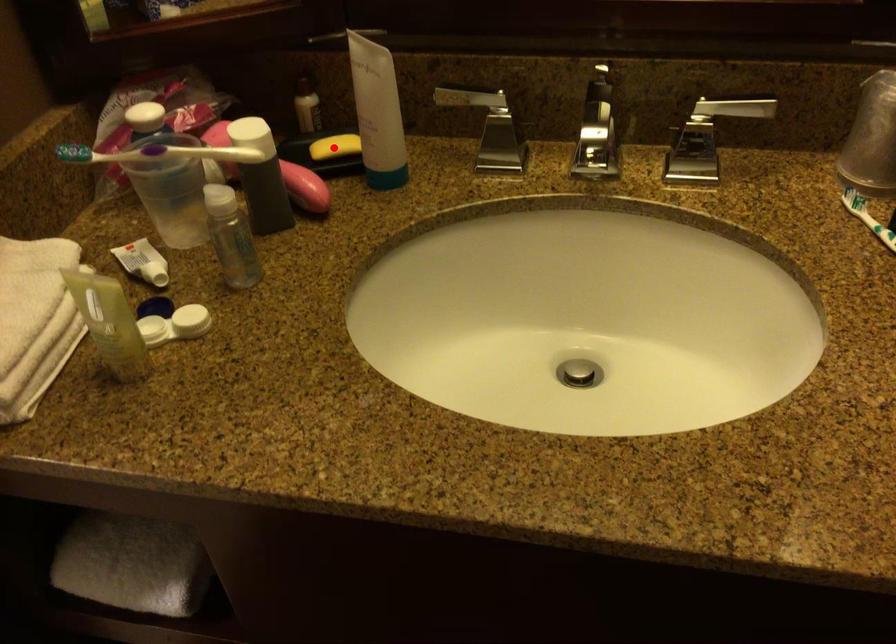
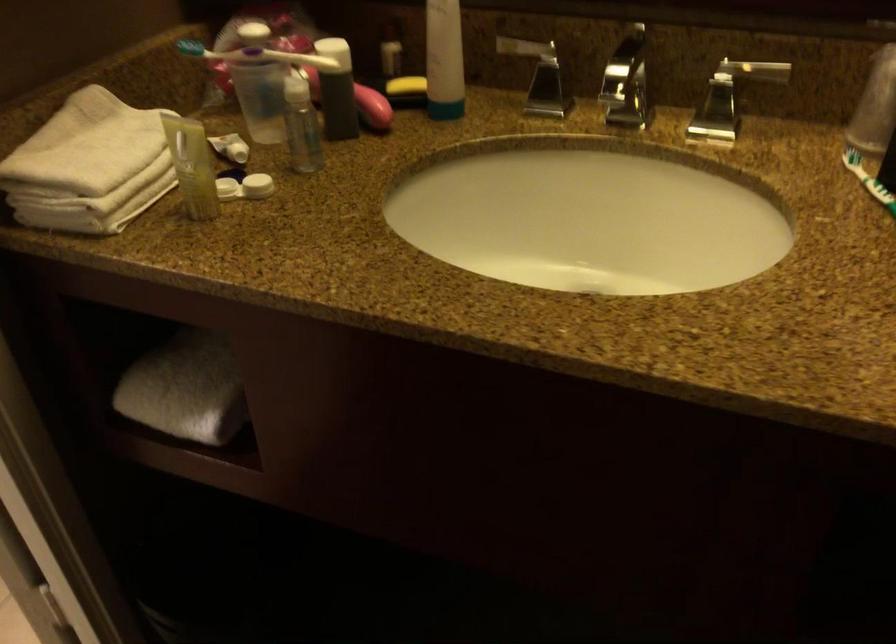
The point at the highlighted location is marked in the first image. Where is the corresponding point in the second image?

(406, 84)